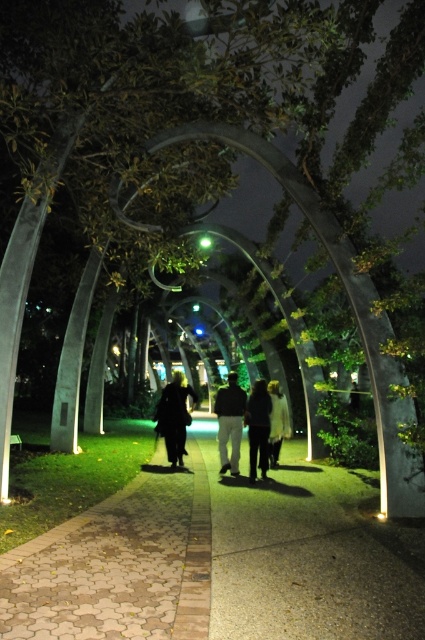
Question: Among these objects, which one is farthest from the camera?

Choices:
 (A) dark fabric pants at center
 (B) dark gray fabric pants at center
 (C) white fabric jacket at center
 (D) brown cobblestone pavement at center

Answer: (B)

Question: Which of these objects is positioned closest to the black matte coat at center?

Choices:
 (A) brown cobblestone pavement at center
 (B) white fabric jacket at center
 (C) dark gray fabric pants at center

Answer: (B)

Question: Is dark fabric pants at center in front of white fabric jacket at center?

Choices:
 (A) yes
 (B) no

Answer: (A)

Question: Can you confirm if black matte coat at center is thinner than white fabric jacket at center?

Choices:
 (A) yes
 (B) no

Answer: (B)

Question: Considering the real-world distances, which object is closest to the dark fabric pants at center?

Choices:
 (A) brown cobblestone pavement at center
 (B) white fabric jacket at center

Answer: (B)

Question: Can you confirm if dark gray fabric pants at center is thinner than white fabric jacket at center?

Choices:
 (A) yes
 (B) no

Answer: (A)